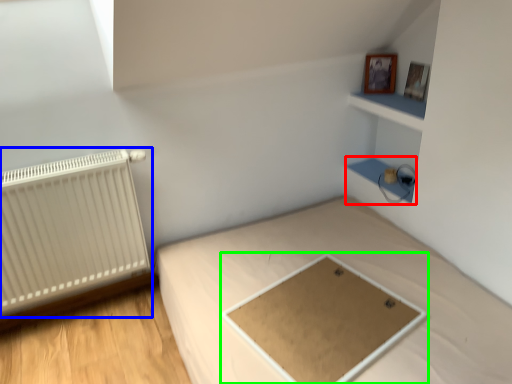
Question: Which object is positioned farthest from cabinet (highlighted by a red box)? Select from radiator (highlighted by a blue box) and table (highlighted by a green box).

Choices:
 (A) radiator
 (B) table

Answer: (A)